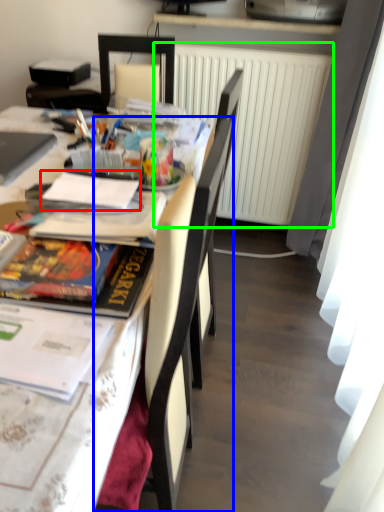
Question: Which is nearer to the journal (highlighted by a red box)? chair (highlighted by a blue box) or radiator (highlighted by a green box).

Choices:
 (A) chair
 (B) radiator

Answer: (A)